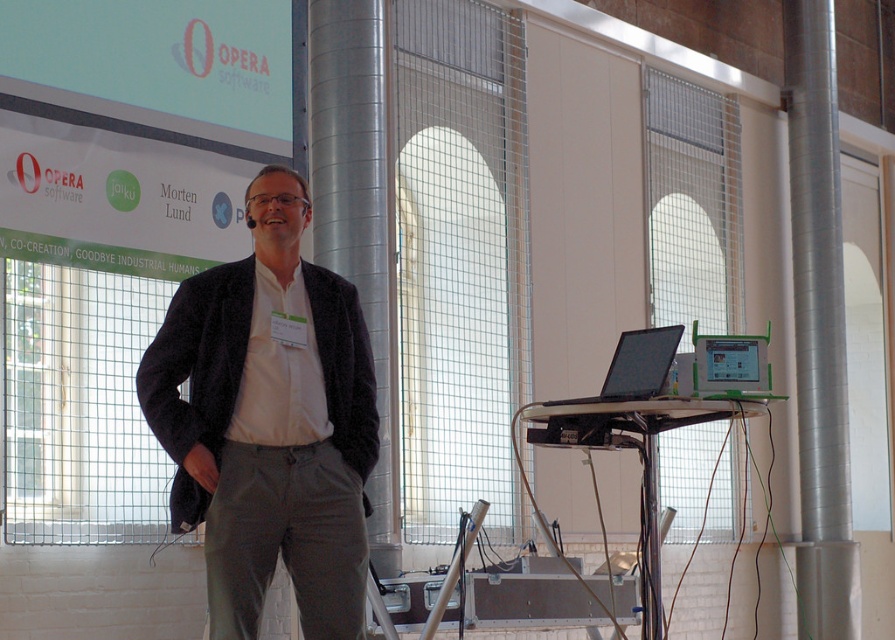
Question: Among these objects, which one is nearest to the camera?

Choices:
 (A) silver metallic pillar at center
 (B) green plastic tablet at center
 (C) black glossy laptop at right
 (D) silver metallic pillar at right

Answer: (B)

Question: Which object is positioned closest to the green plastic tablet at center?

Choices:
 (A) silver metallic pillar at center
 (B) matte white screen at upper left

Answer: (A)

Question: Does silver metallic pillar at center lie behind black glossy laptop at right?

Choices:
 (A) no
 (B) yes

Answer: (B)

Question: Which point is closer to the camera taking this photo?

Choices:
 (A) (114, 26)
 (B) (624, 385)

Answer: (B)

Question: Is silver metallic pillar at center positioned behind black glossy laptop at right?

Choices:
 (A) yes
 (B) no

Answer: (A)

Question: Considering the relative positions of dark gray textured blazer at center and silver metallic pillar at right in the image provided, where is dark gray textured blazer at center located with respect to silver metallic pillar at right?

Choices:
 (A) right
 (B) left

Answer: (B)